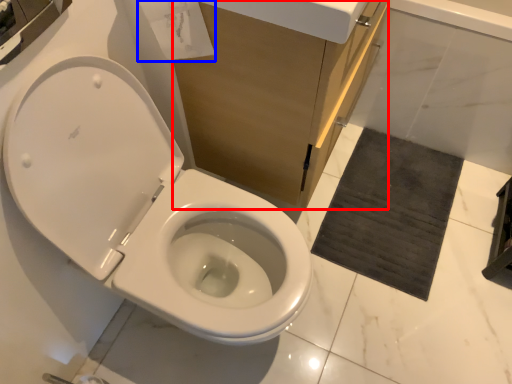
Question: Which of the following is the farthest to the observer, cabinetry (highlighted by a red box) or toilet paper (highlighted by a blue box)?

Choices:
 (A) cabinetry
 (B) toilet paper

Answer: (A)